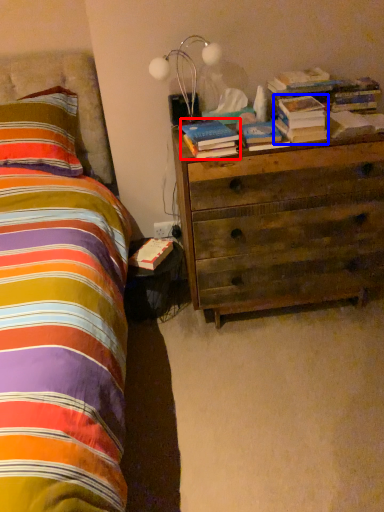
Question: Which of the following is the farthest to the observer, book (highlighted by a red box) or book (highlighted by a blue box)?

Choices:
 (A) book
 (B) book

Answer: (B)